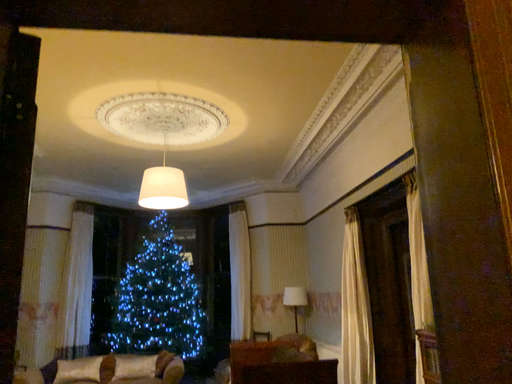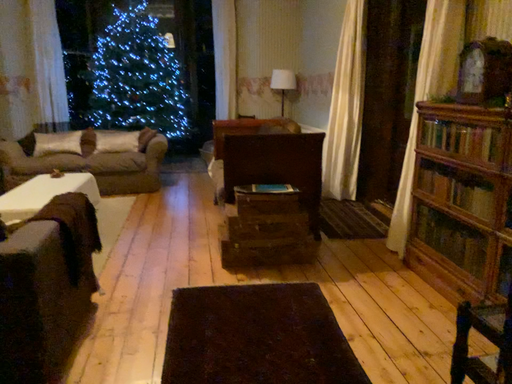
Question: Which way did the camera rotate in the video?

Choices:
 (A) rotated downward
 (B) rotated upward

Answer: (A)